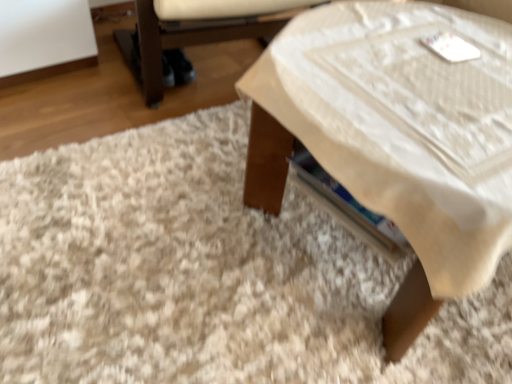
Question: From a real-world perspective, is wooden table at center physically located above or below white shaggy rug at lower left?

Choices:
 (A) below
 (B) above

Answer: (B)

Question: Considering the positions of wooden table at center and white shaggy rug at lower left in the image, is wooden table at center taller or shorter than white shaggy rug at lower left?

Choices:
 (A) short
 (B) tall

Answer: (B)

Question: Based on their relative distances, which object is nearer to the wooden table at center?

Choices:
 (A) white fabric armchair at lower right
 (B) white shaggy rug at lower left

Answer: (B)

Question: Which of these objects is positioned closest to the wooden table at center?

Choices:
 (A) white fabric armchair at lower right
 (B) white shaggy rug at lower left

Answer: (B)